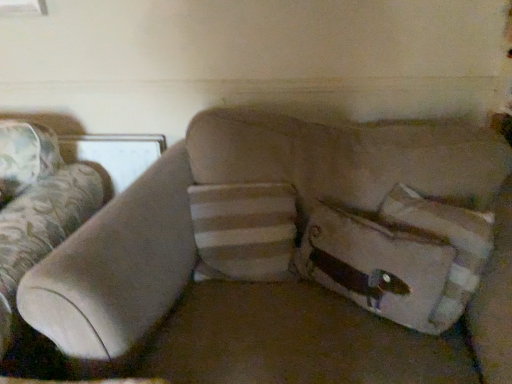
Question: From the image's perspective, is suede beige couch at center located beneath white striped pillow at right?

Choices:
 (A) no
 (B) yes

Answer: (B)

Question: Does suede beige couch at center have a lesser height compared to white striped pillow at right?

Choices:
 (A) no
 (B) yes

Answer: (A)

Question: Is suede beige couch at center facing towards white striped pillow at right?

Choices:
 (A) no
 (B) yes

Answer: (B)

Question: Does suede beige couch at center have a lesser width compared to white striped pillow at right?

Choices:
 (A) no
 (B) yes

Answer: (A)

Question: Is suede beige couch at center to the right of white striped pillow at right from the viewer's perspective?

Choices:
 (A) no
 (B) yes

Answer: (A)

Question: Does suede beige couch at center have a smaller size compared to white striped pillow at right?

Choices:
 (A) no
 (B) yes

Answer: (A)

Question: Is white striped pillow at right positioned before suede beige couch at center?

Choices:
 (A) yes
 (B) no

Answer: (B)

Question: Is suede beige couch at center completely or partially inside white striped pillow at right?

Choices:
 (A) yes
 (B) no

Answer: (B)

Question: Is white striped pillow at right shorter than suede beige couch at center?

Choices:
 (A) no
 (B) yes

Answer: (B)

Question: From the image's perspective, is white striped pillow at right below suede beige couch at center?

Choices:
 (A) yes
 (B) no

Answer: (B)

Question: Is white striped pillow at right positioned with its back to suede beige couch at center?

Choices:
 (A) yes
 (B) no

Answer: (A)

Question: Can you confirm if white striped pillow at right is wider than suede beige couch at center?

Choices:
 (A) yes
 (B) no

Answer: (B)

Question: Considering the positions of white striped pillow at right and suede beige couch at center in the image, is white striped pillow at right taller or shorter than suede beige couch at center?

Choices:
 (A) short
 (B) tall

Answer: (A)